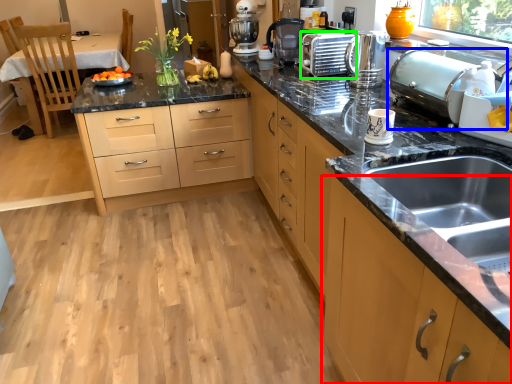
Question: Which is nearer to the cabinetry (highlighted by a red box)? appliance (highlighted by a blue box) or appliance (highlighted by a green box).

Choices:
 (A) appliance
 (B) appliance

Answer: (A)